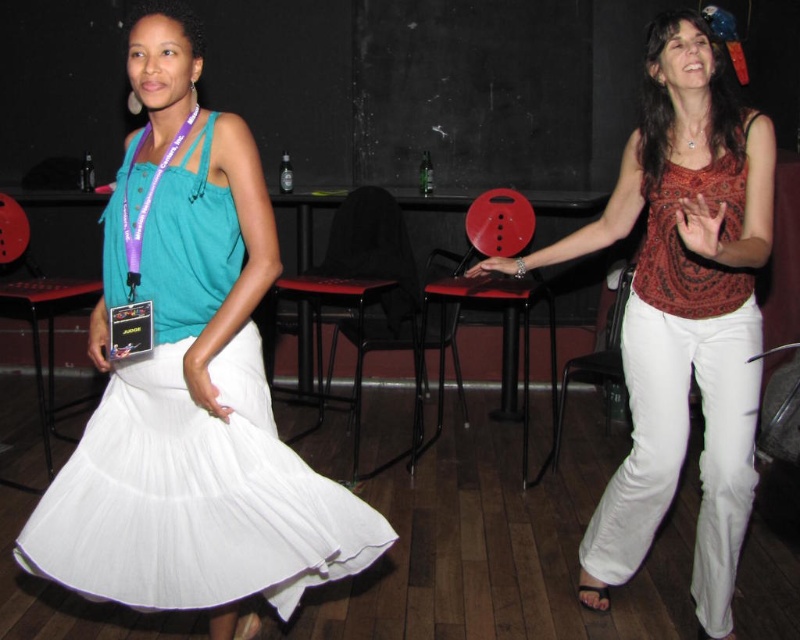
Can you confirm if white pleated skirt at center is taller than matte red blouse at center?

No.

Measure the distance between white pleated skirt at center and matte red blouse at center.

white pleated skirt at center is 3.78 feet from matte red blouse at center.

Locate an element on the screen. white pleated skirt at center is located at coordinates (190, 385).

Locate an element on the screen. Image resolution: width=800 pixels, height=640 pixels. white pleated skirt at center is located at coordinates (190, 385).